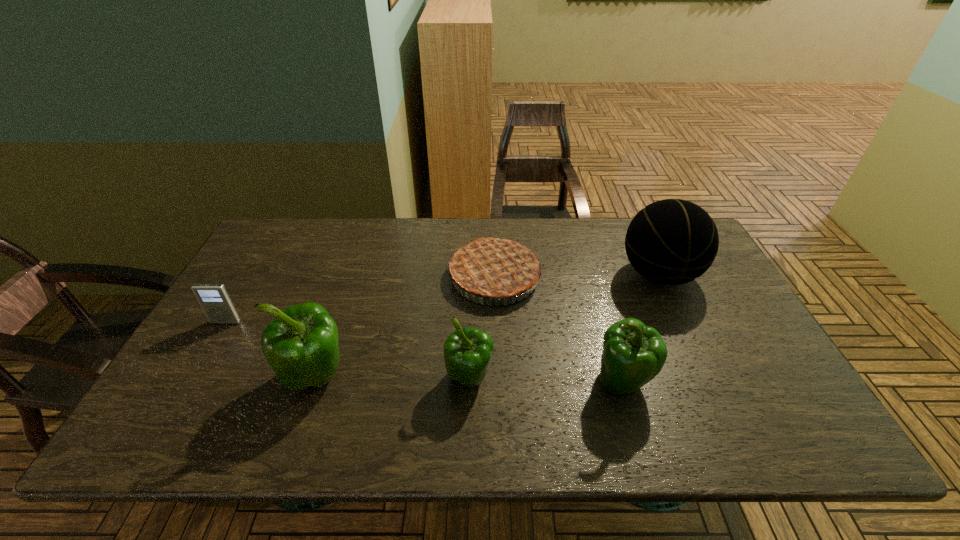
This screenshot has width=960, height=540. I want to click on vacant spot to place a bell pepper on the right, so click(778, 384).